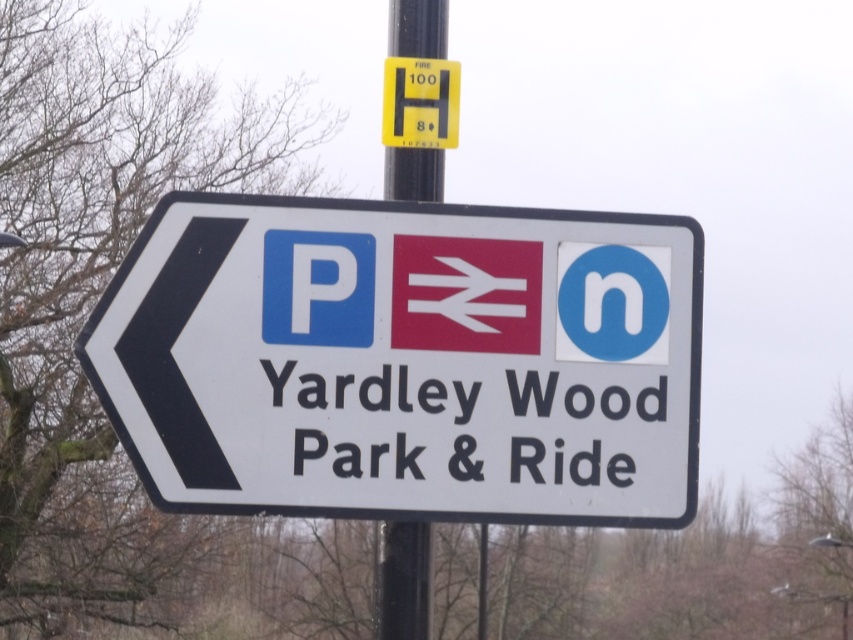
Question: Which point is farther from the camera taking this photo?

Choices:
 (A) (259, 292)
 (B) (442, 29)

Answer: (B)

Question: Which point is farther to the camera?

Choices:
 (A) (577, 301)
 (B) (387, 198)

Answer: (B)

Question: Can you confirm if white plastic sign at center is positioned below metallic pole at upper center?

Choices:
 (A) no
 (B) yes

Answer: (B)

Question: Among these points, which one is nearest to the camera?

Choices:
 (A) (412, 40)
 (B) (310, 248)

Answer: (B)

Question: Is the position of white plastic sign at center less distant than that of metallic pole at upper center?

Choices:
 (A) no
 (B) yes

Answer: (B)

Question: Is white plastic sign at center smaller than metallic pole at upper center?

Choices:
 (A) no
 (B) yes

Answer: (A)